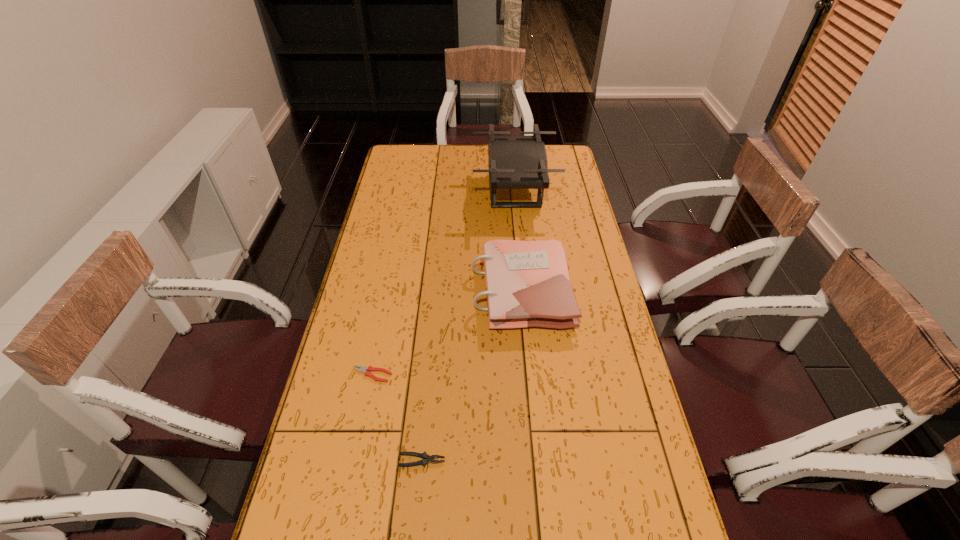
Where is `free space between the drone and the shorter pliers`? This screenshot has height=540, width=960. free space between the drone and the shorter pliers is located at coordinates (444, 283).

You are a GUI agent. You are given a task and a screenshot of the screen. Output one action in this format:
    pyautogui.click(x=<x>, y=<y>)
    Task: Click on the vacant space in between the third farthest object and the second farthest object
    This screenshot has height=540, width=960.
    Given the screenshot: What is the action you would take?
    pyautogui.click(x=446, y=333)

Point out which object is positioned as the third nearest to the leftmost object. Please provide its 2D coordinates. Your answer should be formatted as a tuple, i.e. [(x, y)], where the tuple contains the x and y coordinates of a point satisfying the conditions above.

[(515, 162)]

Select which object appears as the closest to the leftmost object. Please provide its 2D coordinates. Your answer should be formatted as a tuple, i.e. [(x, y)], where the tuple contains the x and y coordinates of a point satisfying the conditions above.

[(426, 458)]

The height and width of the screenshot is (540, 960). Identify the location of free region that satisfies the following two spatial constraints: 1. on the front side of the third nearest object; 2. at the gripping part of the nearer pliers. (536, 461).

This screenshot has width=960, height=540. I want to click on vacant space that satisfies the following two spatial constraints: 1. with a camera mounted on the underside of the tallest object; 2. on the front side of the farther pliers, so click(x=532, y=375).

At what (x,y) coordinates should I click in order to perform the action: click on free point that satisfies the following two spatial constraints: 1. with a camera mounted on the underside of the tallest object; 2. on the front side of the left pliers. Please return your answer as a coordinate pair (x, y). Looking at the image, I should click on (532, 375).

In order to click on vacant space that satisfies the following two spatial constraints: 1. with a camera mounted on the underside of the drone; 2. on the front side of the shortest object in this screenshot , I will do `click(532, 375)`.